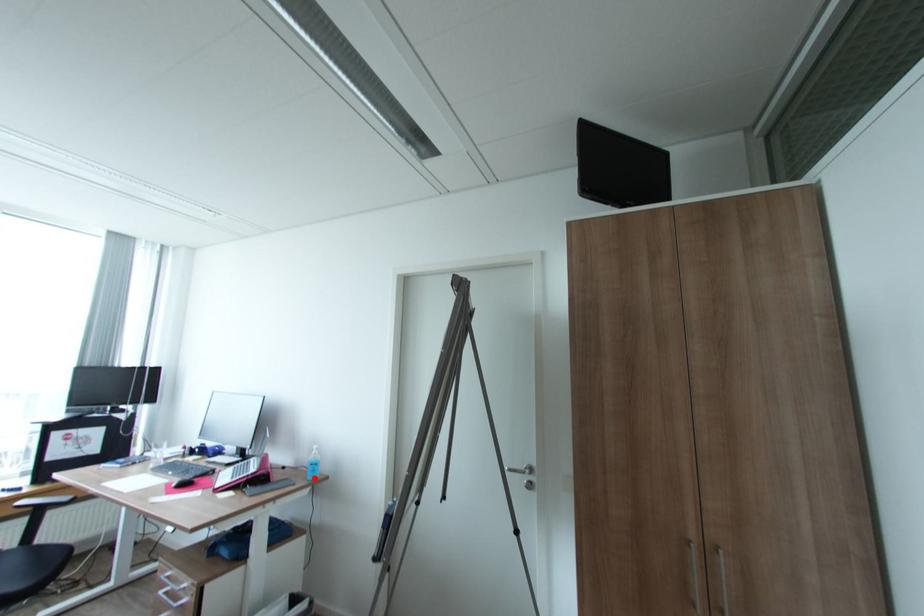
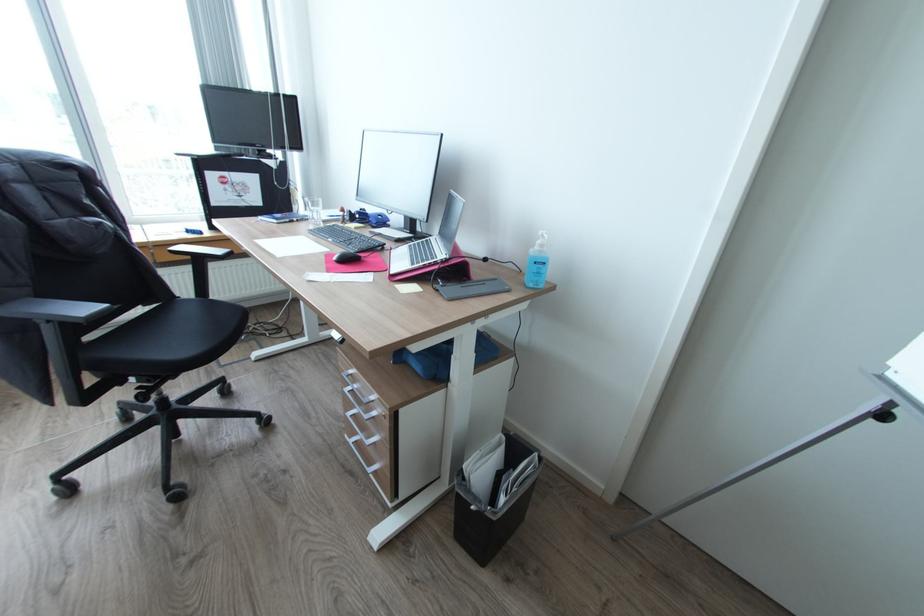
Question: I am providing you with two images of the same scene from different viewpoints. In image1, a red point is highlighted. Considering the same 3D point in image2, which of the following is correct?

Choices:
 (A) It is closer
 (B) It is farther

Answer: (A)